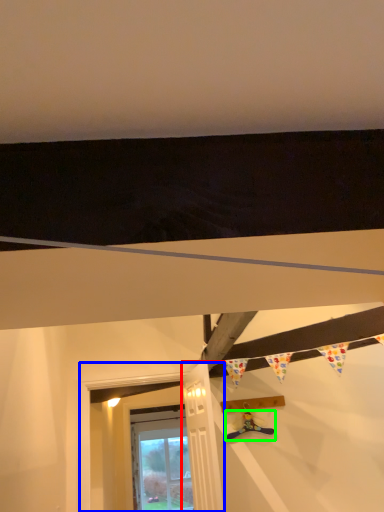
Question: Which object is the closest to the door (highlighted by a red box)? Choose among these: window frame (highlighted by a blue box) or toy (highlighted by a green box).

Choices:
 (A) window frame
 (B) toy

Answer: (B)